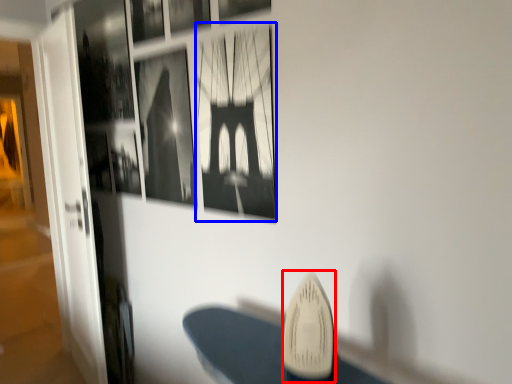
Question: Which point is closer to the camera, surfboard (highlighted by a red box) or picture frame (highlighted by a blue box)?

Choices:
 (A) surfboard
 (B) picture frame

Answer: (A)